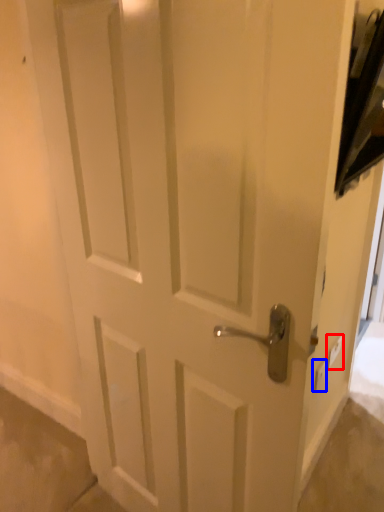
Question: Which of the following is the farthest to the observer, light switch (highlighted by a red box) or light switch (highlighted by a blue box)?

Choices:
 (A) light switch
 (B) light switch

Answer: (A)